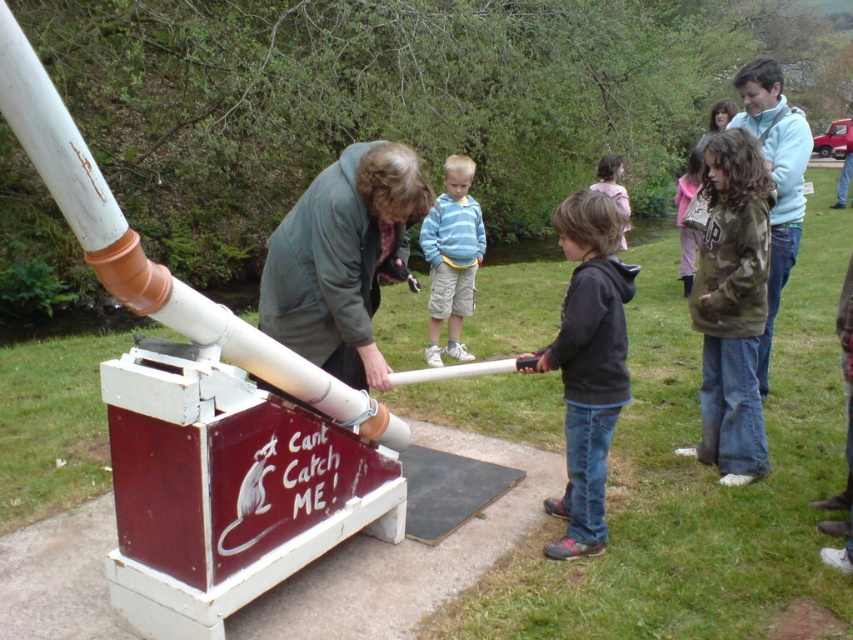
Question: Can you confirm if white matte pipe at center is wider than blue striped shirt at center?

Choices:
 (A) no
 (B) yes

Answer: (B)

Question: Among these points, which one is nearest to the camera?

Choices:
 (A) (323, 369)
 (B) (599, 163)
 (C) (453, 324)

Answer: (A)

Question: Which of the following is the closest to the observer?

Choices:
 (A) (618, 193)
 (B) (799, 224)
 (C) (27, 88)
 (D) (717, 237)

Answer: (C)

Question: Estimate the real-world distances between objects in this image. Which object is closer to the green matte jacket at center?

Choices:
 (A) white matte pipe at center
 (B) light blue sweater at upper right

Answer: (A)

Question: Does white matte pipe at center have a lesser width compared to light brown hair at center?

Choices:
 (A) yes
 (B) no

Answer: (A)

Question: Is green matte jacket at center wider than black hoodie at center?

Choices:
 (A) no
 (B) yes

Answer: (B)